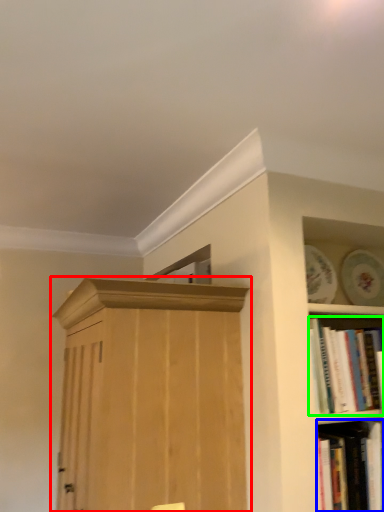
Question: Based on their relative distances, which object is farther from cupboard (highlighted by a red box)? Choose from book (highlighted by a blue box) and book (highlighted by a green box).

Choices:
 (A) book
 (B) book

Answer: (A)